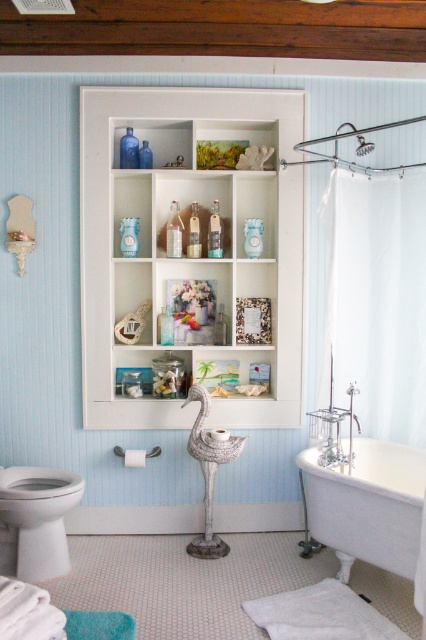
Can you confirm if white matte cabinet at center is wider than white fabric shower curtain at right?

Yes.

Is white matte cabinet at center to the right of white fabric shower curtain at right from the viewer's perspective?

Incorrect, white matte cabinet at center is not on the right side of white fabric shower curtain at right.

Who is more distant from viewer, (146, 221) or (417, 413)?

The point (146, 221) is more distant.

I want to click on white matte cabinet at center, so click(189, 257).

Is white porcelain bathtub at lower right thinner than white glossy toilet bowl at lower left?

No, white porcelain bathtub at lower right is not thinner than white glossy toilet bowl at lower left.

Which is in front, point (316, 480) or point (68, 476)?

Point (316, 480) is in front.

Where is `white porcelain bathtub at lower right`? white porcelain bathtub at lower right is located at coordinates (368, 504).

Which is above, white matte cabinet at center or white glossy toilet bowl at lower left?

white matte cabinet at center is higher up.

Is point (95, 406) farther from viewer compared to point (71, 496)?

Yes.

Between point (288, 380) and point (62, 536), which one is positioned in front?

Point (62, 536) is more forward.

The image size is (426, 640). What are the coordinates of `white matte cabinet at center` in the screenshot? It's located at (189, 257).